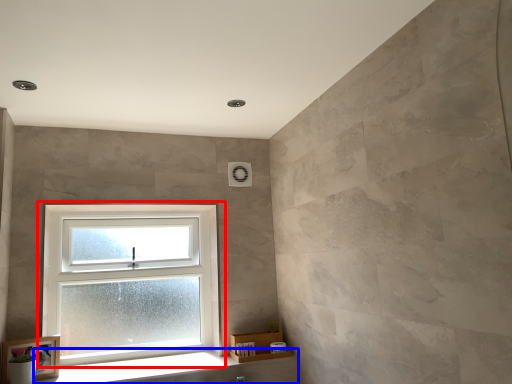
Question: Among these objects, which one is farthest to the camera, window (highlighted by a red box) or window sill (highlighted by a blue box)?

Choices:
 (A) window
 (B) window sill

Answer: (A)